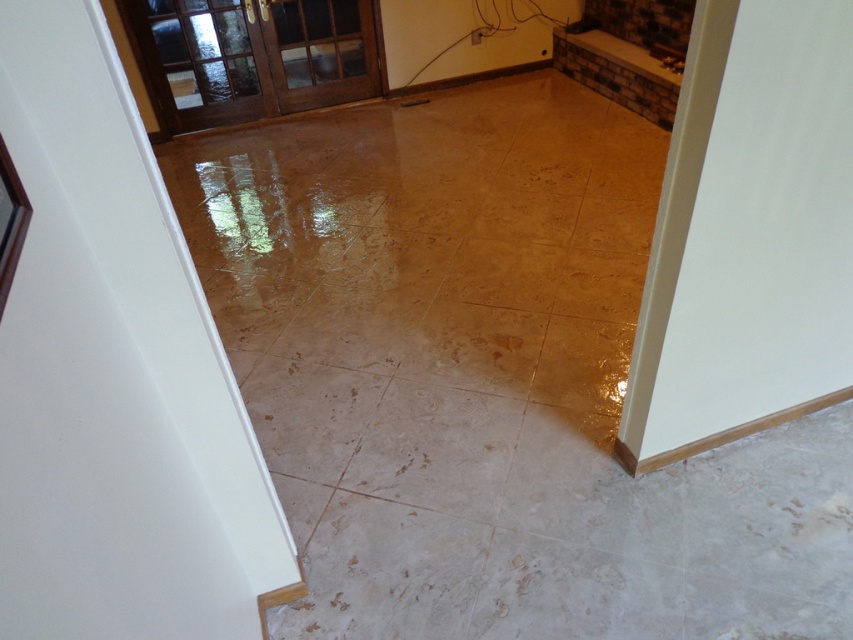
Question: Does white marble tile at center have a smaller size compared to white marble tile at lower center?

Choices:
 (A) no
 (B) yes

Answer: (A)

Question: Which point is farther from the camera taking this photo?

Choices:
 (A) (288, 509)
 (B) (326, 458)

Answer: (B)

Question: Which object appears farthest from the camera in this image?

Choices:
 (A) white marble tile at lower center
 (B) white marble tile at center
 (C) beige marble tile at center
 (D) brown polished tile at center

Answer: (D)

Question: Which of the following is the closest to the observer?

Choices:
 (A) (514, 348)
 (B) (331, 458)
 (C) (509, 413)

Answer: (B)

Question: Does white marble tile at center appear over brown polished tile at center?

Choices:
 (A) no
 (B) yes

Answer: (A)

Question: Is brown polished tile at center further to the viewer compared to shiny gold tile at lower right?

Choices:
 (A) no
 (B) yes

Answer: (B)